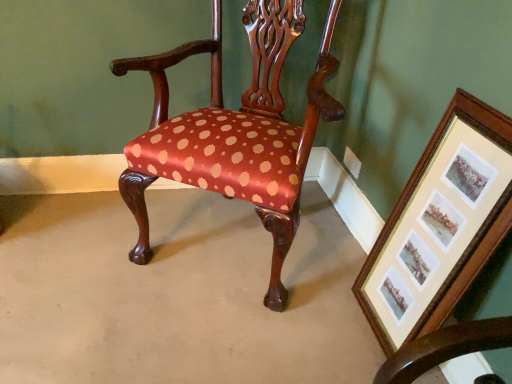
Question: From the image's perspective, is satin fabric chair at center positioned above or below wooden framed prints at lower right?

Choices:
 (A) below
 (B) above

Answer: (B)

Question: Based on their sizes in the image, would you say satin fabric chair at center is bigger or smaller than wooden framed prints at lower right?

Choices:
 (A) big
 (B) small

Answer: (A)

Question: In the image, is satin fabric chair at center positioned in front of or behind wooden framed prints at lower right?

Choices:
 (A) front
 (B) behind

Answer: (B)

Question: Considering the positions of wooden framed prints at lower right and satin fabric chair at center in the image, is wooden framed prints at lower right wider or thinner than satin fabric chair at center?

Choices:
 (A) thin
 (B) wide

Answer: (A)

Question: From a real-world perspective, relative to satin fabric chair at center, is wooden framed prints at lower right vertically above or below?

Choices:
 (A) above
 (B) below

Answer: (B)

Question: From their relative heights in the image, would you say wooden framed prints at lower right is taller or shorter than satin fabric chair at center?

Choices:
 (A) tall
 (B) short

Answer: (B)

Question: Looking at the image, does wooden framed prints at lower right seem bigger or smaller compared to satin fabric chair at center?

Choices:
 (A) big
 (B) small

Answer: (B)